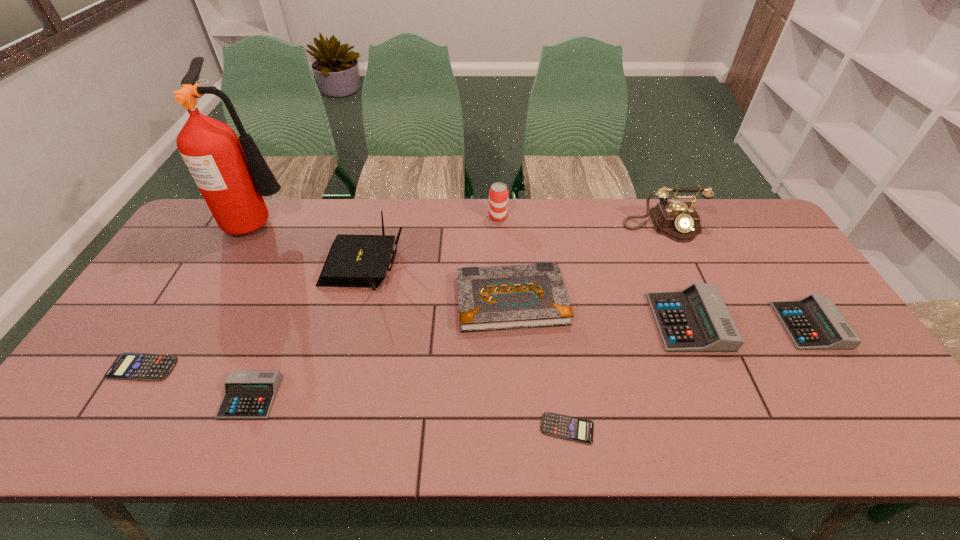
This screenshot has width=960, height=540. I want to click on free space located 0.280m on the right of the beer can, so click(x=588, y=217).

Where is `vacant space located on the front of the black router`? vacant space located on the front of the black router is located at coordinates coord(336,375).

In order to click on blank space located on the left of the second gray calculator from left to right in this screenshot , I will do `click(566, 322)`.

Locate an element on the screen. Image resolution: width=960 pixels, height=540 pixels. vacant space situated 0.200m on the back of the notebook is located at coordinates [507, 228].

Locate an element on the screen. This screenshot has width=960, height=540. free space located 0.070m on the left of the fourth shortest calculator is located at coordinates (756, 326).

At what (x,y) coordinates should I click in order to perform the action: click on free region located 0.230m on the right of the nearest gray calculator. Please return your answer as a coordinate pair (x, y). Looking at the image, I should click on (372, 397).

Find the location of a particular element. vacant space situated 0.160m on the back of the left blue calculator is located at coordinates click(x=181, y=306).

This screenshot has height=540, width=960. I want to click on vacant space situated on the left of the nearer blue calculator, so click(x=375, y=429).

The width and height of the screenshot is (960, 540). I want to click on fire extinguisher that is positioned at the far edge, so click(232, 175).

You are a GUI agent. You are given a task and a screenshot of the screen. Output one action in this format:
    pyautogui.click(x=<x>, y=<y>)
    Task: Click on the telephone at the far edge
    This screenshot has height=540, width=960.
    Given the screenshot: What is the action you would take?
    pyautogui.click(x=679, y=221)